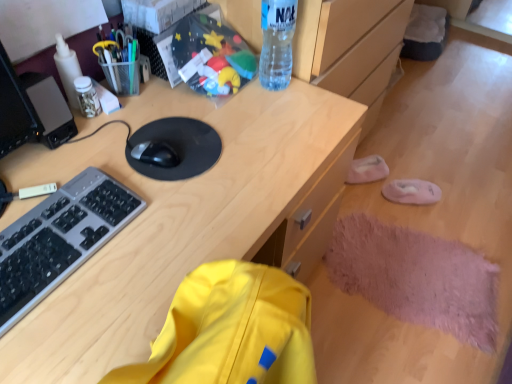
Image resolution: width=512 pixels, height=384 pixels. Identify the location of free region under black matte mousepad at center (from a real-world perspective). (177, 139).